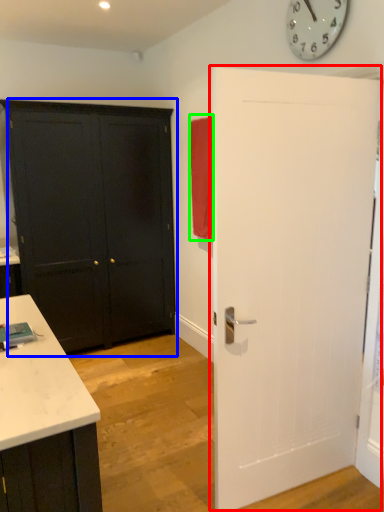
Question: Estimate the real-world distances between objects in this image. Which object is closer to door (highlighted by a red box), door (highlighted by a blue box) or curtain (highlighted by a green box)?

Choices:
 (A) door
 (B) curtain

Answer: (B)